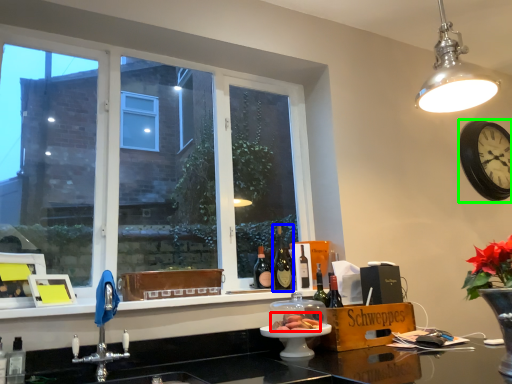
Question: Which is farther away from food (highlighted by a red box)? bottle (highlighted by a blue box) or clock (highlighted by a green box)?

Choices:
 (A) bottle
 (B) clock

Answer: (B)